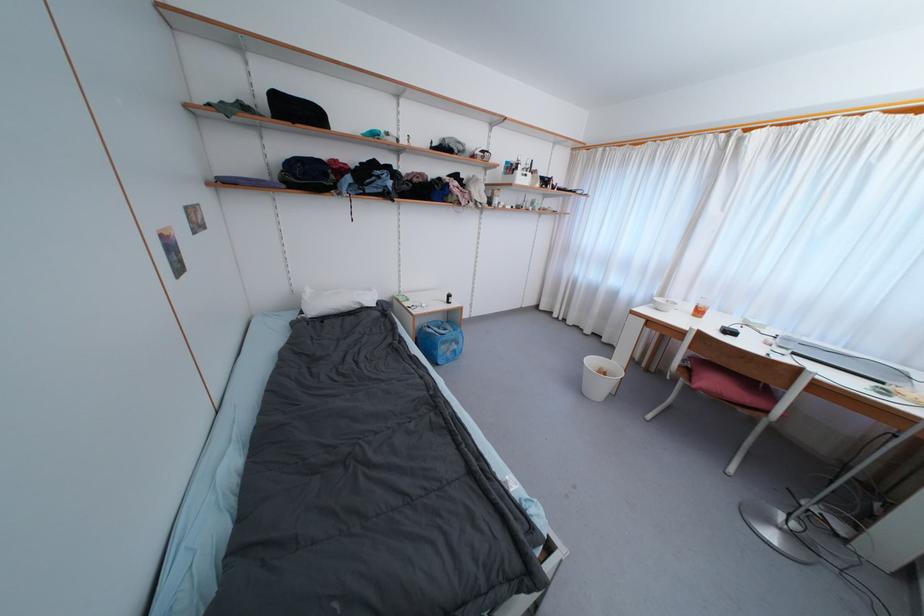
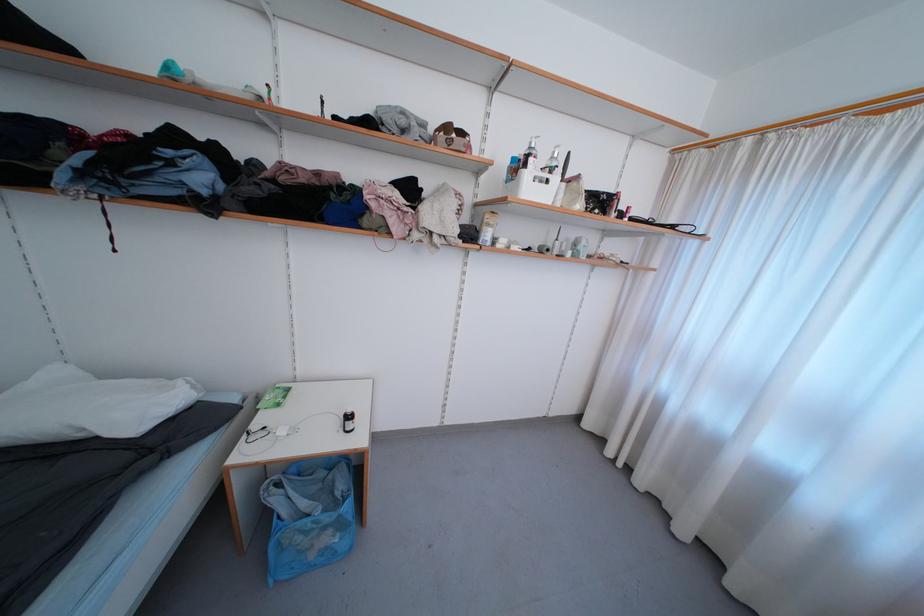
Where in the second image is the point corresponding to (x=520, y=171) from the first image?

(529, 168)